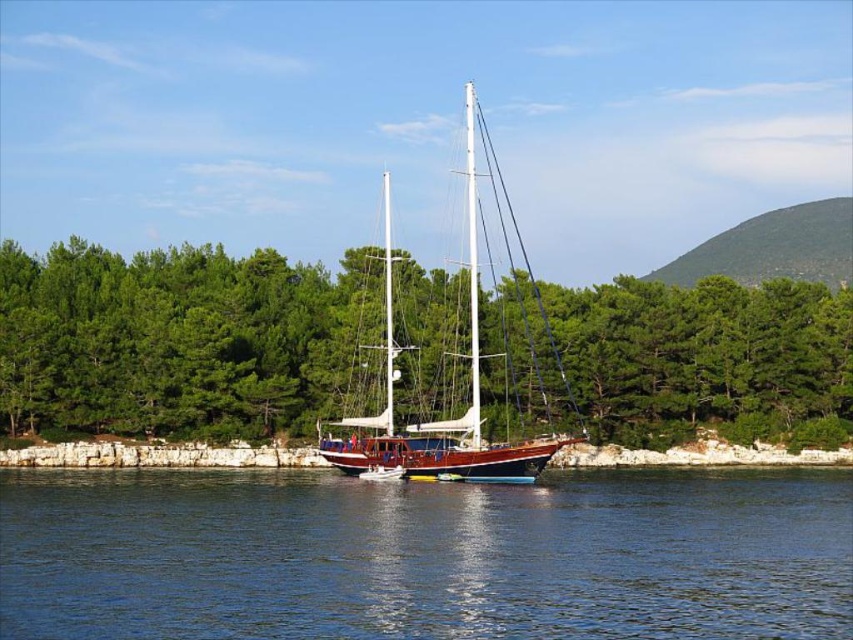
Question: Can you confirm if green leafy trees at center is smaller than wooden sailboat at center?

Choices:
 (A) yes
 (B) no

Answer: (B)

Question: Which point is closer to the camera?

Choices:
 (A) blue water at center
 (B) wooden sailboat at center

Answer: (A)

Question: Among these objects, which one is farthest from the camera?

Choices:
 (A) wooden sailboat at center
 (B) green leafy trees at center
 (C) blue water at center

Answer: (B)

Question: Is the position of blue water at center less distant than that of wooden sailboat at center?

Choices:
 (A) no
 (B) yes

Answer: (B)

Question: Does blue water at center appear over green leafy trees at center?

Choices:
 (A) yes
 (B) no

Answer: (B)

Question: Which of the following is the farthest from the observer?

Choices:
 (A) green leafy trees at center
 (B) wooden sailboat at center
 (C) blue water at center

Answer: (A)